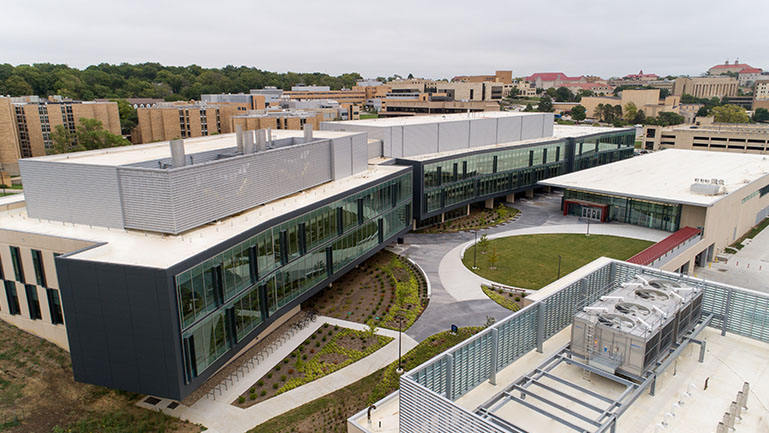
Locate an element on the screen. Image resolution: width=769 pixels, height=433 pixels. air conditioning units is located at coordinates (621, 329), (638, 309), (660, 291), (671, 285).